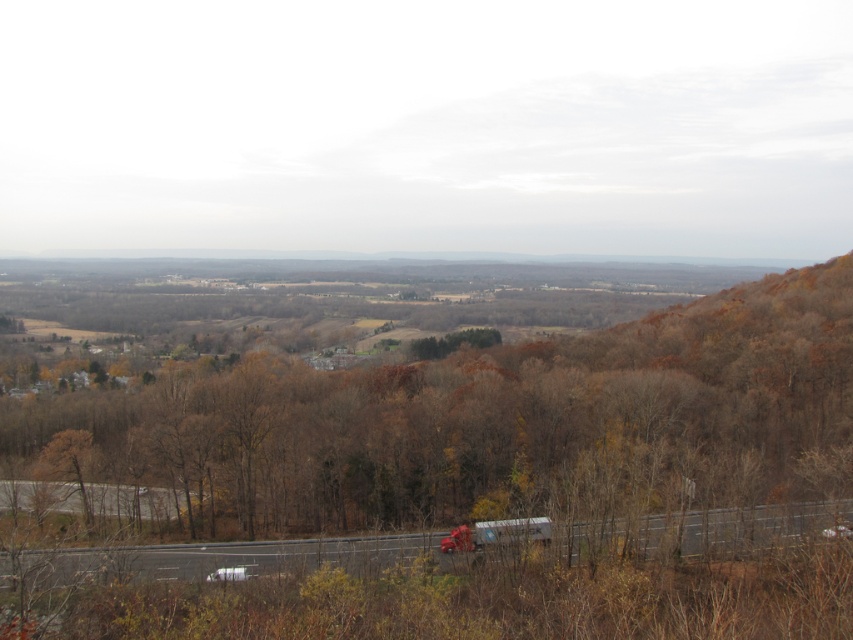
Question: Which of the following is the closest to the observer?

Choices:
 (A) metallic silver truck at lower center
 (B) brown matte tree at center

Answer: (A)

Question: Can you confirm if brown matte tree at center is wider than metallic silver truck at lower center?

Choices:
 (A) no
 (B) yes

Answer: (B)

Question: Among these objects, which one is nearest to the camera?

Choices:
 (A) metallic silver truck at lower center
 (B) brown matte tree at center

Answer: (A)

Question: Does brown matte tree at center have a greater width compared to metallic silver truck at lower center?

Choices:
 (A) no
 (B) yes

Answer: (B)

Question: Does brown matte tree at center appear over metallic silver truck at lower center?

Choices:
 (A) yes
 (B) no

Answer: (A)